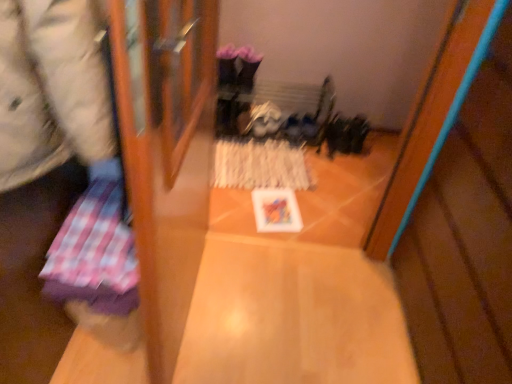
Locate an element on the screen. Image resolution: width=512 pixels, height=384 pixels. vacant space underneath white textured paper at center, the 2th wrapping paper from the front (from a real-world perspective) is located at coordinates (263, 162).